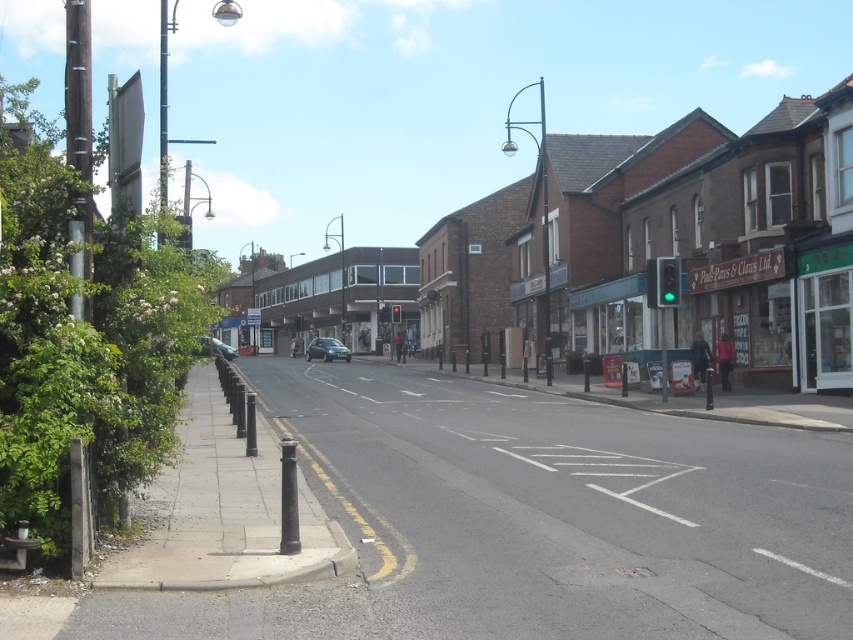
Question: Which point is closer to the camera taking this photo?

Choices:
 (A) (590, 307)
 (B) (219, 340)
 (C) (345, 355)
 (D) (276, 342)

Answer: (A)

Question: Is dark brown glass building at center in front of shiny silver car at center?

Choices:
 (A) yes
 (B) no

Answer: (B)

Question: Is brown brick building at center in front of metallic silver car at center?

Choices:
 (A) no
 (B) yes

Answer: (A)

Question: Which point is farther to the camera?

Choices:
 (A) brown brick building at center
 (B) shiny silver car at center

Answer: (B)

Question: Is dark brown glass building at center to the right of metallic silver car at center from the viewer's perspective?

Choices:
 (A) yes
 (B) no

Answer: (A)

Question: Among these objects, which one is farthest from the camera?

Choices:
 (A) brown brick building at center
 (B) dark brown glass building at center
 (C) metallic silver car at center

Answer: (B)